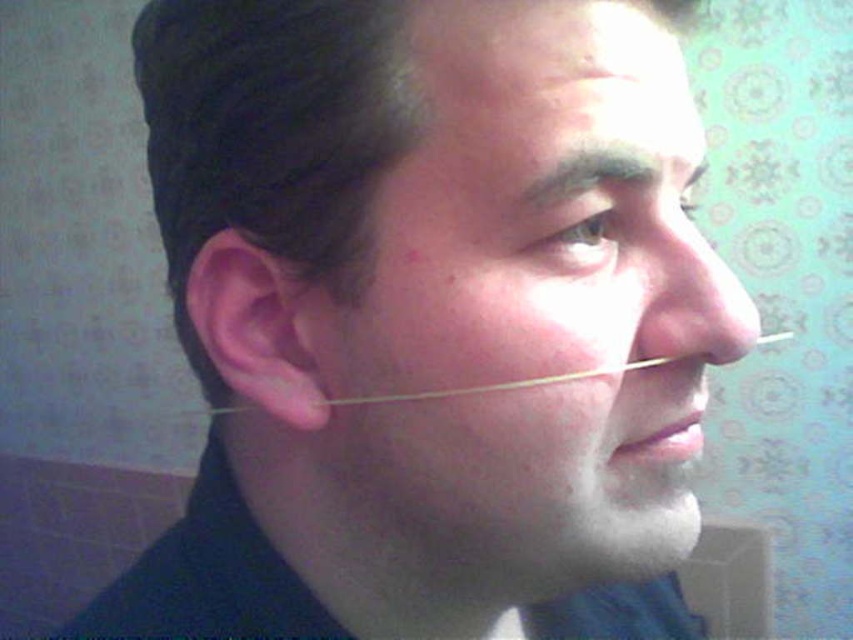
Looking at this image, is smooth skin face at center taller than clear plastic tube at nose?

Yes.

Which is more to the right, smooth skin face at center or clear plastic tube at nose?

From the viewer's perspective, smooth skin face at center appears more on the right side.

Is point (556, 128) in front of point (361, 401)?

Yes.

Locate an element on the screen. The height and width of the screenshot is (640, 853). smooth skin face at center is located at coordinates (531, 307).

Between point (566, 189) and point (397, 394), which one is positioned in front?

Positioned in front is point (566, 189).

Find the location of `dark brown hair at upper center`. dark brown hair at upper center is located at coordinates (593, 170).

The width and height of the screenshot is (853, 640). In order to click on smooth skin face at center in this screenshot , I will do point(531,307).

Where is `smooth skin face at center`? The image size is (853, 640). smooth skin face at center is located at coordinates (531, 307).